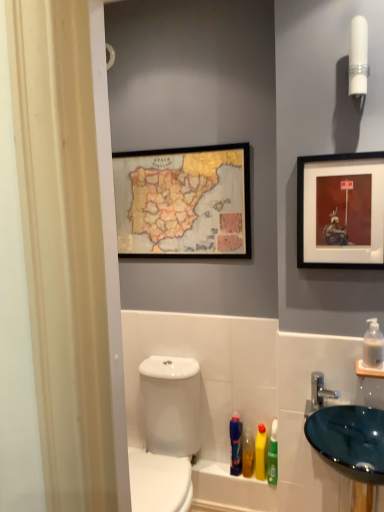
The image size is (384, 512). What are the coordinates of `free space above glossy glass sink at lower right (from a real-world perspective)` in the screenshot? It's located at (347, 417).